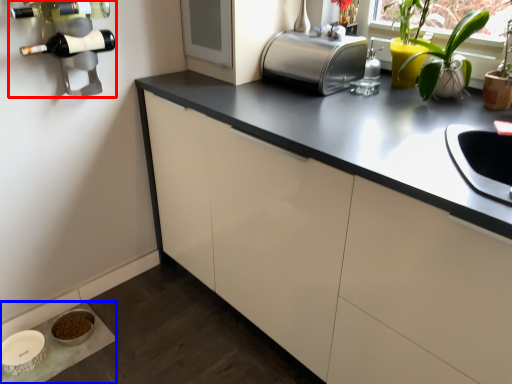
Question: Which object is closer to the camera taking this photo, wine rack (highlighted by a red box) or table (highlighted by a blue box)?

Choices:
 (A) wine rack
 (B) table

Answer: (A)